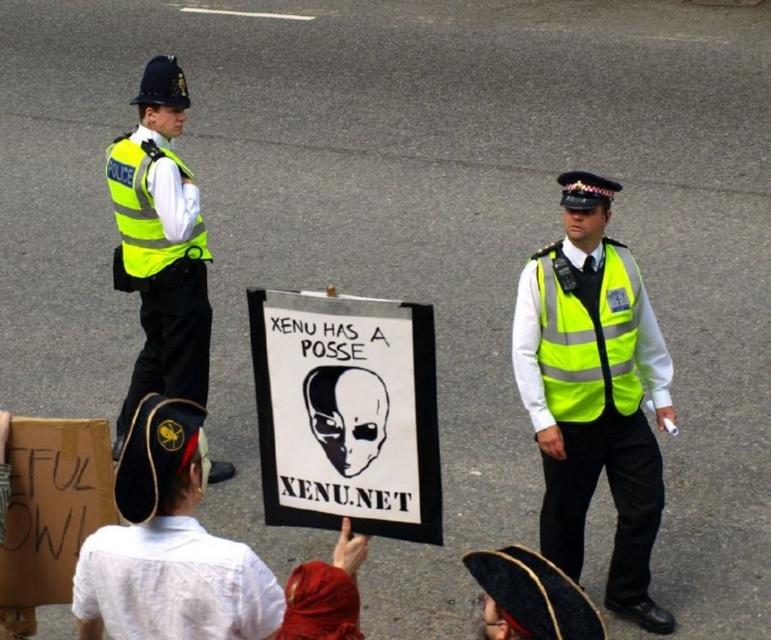
Between high-visibility vest at center and high-visibility yellow vest at left, which one appears on the right side from the viewer's perspective?

high-visibility vest at center

Can you confirm if high-visibility vest at center is wider than high-visibility yellow vest at left?

Correct, the width of high-visibility vest at center exceeds that of high-visibility yellow vest at left.

Find the location of a particular element. The width and height of the screenshot is (771, 640). high-visibility vest at center is located at coordinates (594, 394).

Where is `high-visibility vest at center`? This screenshot has width=771, height=640. high-visibility vest at center is located at coordinates (594, 394).